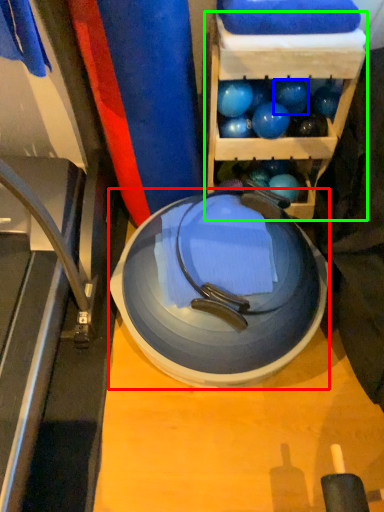
Question: Which object is the closest to the plate (highlighted by a red box)? Choose among these: ball (highlighted by a blue box) or shelf (highlighted by a green box).

Choices:
 (A) ball
 (B) shelf

Answer: (B)